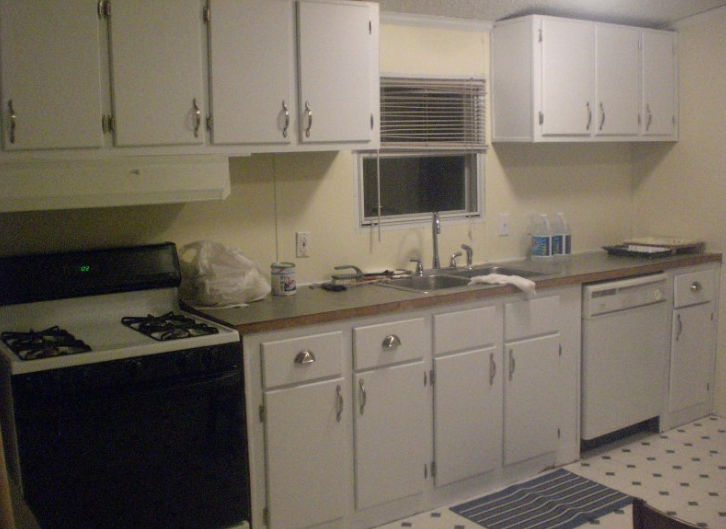
Image resolution: width=726 pixels, height=529 pixels. Find the location of `stove`. stove is located at coordinates (83, 311).